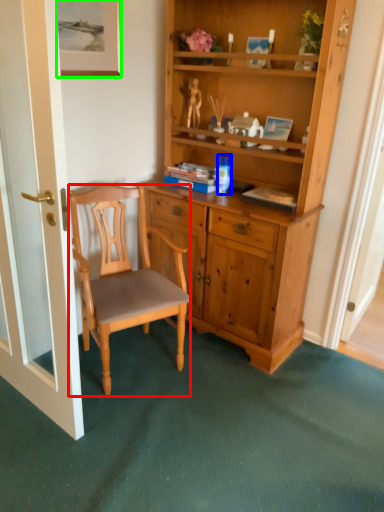
Question: Which object is positioned farthest from chair (highlighted by a red box)? Select from coffee cup (highlighted by a blue box) and picture frame (highlighted by a green box).

Choices:
 (A) coffee cup
 (B) picture frame

Answer: (B)